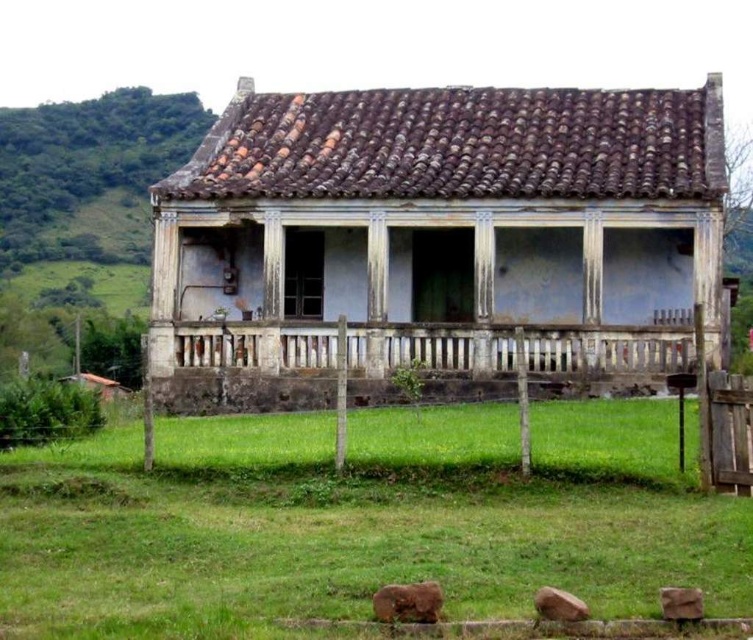
Question: Which point appears closest to the camera in this image?

Choices:
 (A) (383, 337)
 (B) (471, 472)

Answer: (B)

Question: Does green grass at lower center lie in front of white weathered wood porch at center?

Choices:
 (A) no
 (B) yes

Answer: (B)

Question: Among these objects, which one is nearest to the camera?

Choices:
 (A) green grass at lower center
 (B) white weathered wood porch at center

Answer: (A)

Question: Can you confirm if green grass at lower center is positioned above white weathered wood porch at center?

Choices:
 (A) yes
 (B) no

Answer: (B)

Question: Which of the following is the closest to the observer?

Choices:
 (A) (142, 545)
 (B) (157, 342)

Answer: (A)

Question: Can you confirm if green grass at lower center is positioned to the left of white weathered wood porch at center?

Choices:
 (A) yes
 (B) no

Answer: (A)